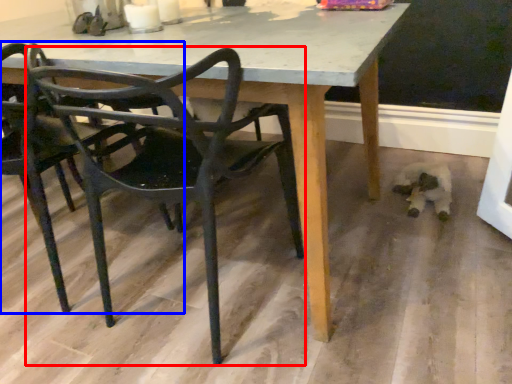
Question: Which object is further to the camera taking this photo, chair (highlighted by a red box) or chair (highlighted by a blue box)?

Choices:
 (A) chair
 (B) chair

Answer: (B)